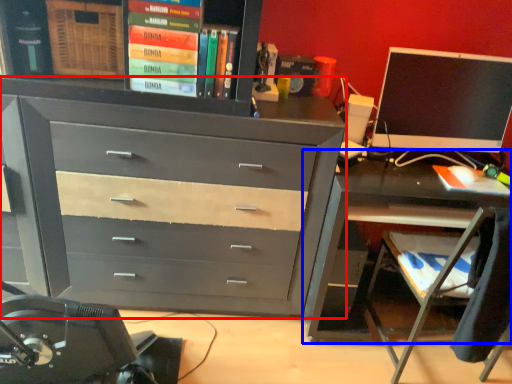
Question: Which object appears farthest to the camera in this image, chest of drawers (highlighted by a red box) or desk (highlighted by a blue box)?

Choices:
 (A) chest of drawers
 (B) desk

Answer: (B)